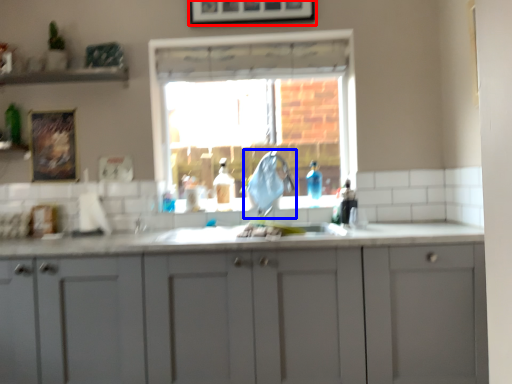
Question: Which point is further to the camera, picture frame (highlighted by a red box) or faucet (highlighted by a blue box)?

Choices:
 (A) picture frame
 (B) faucet

Answer: (A)